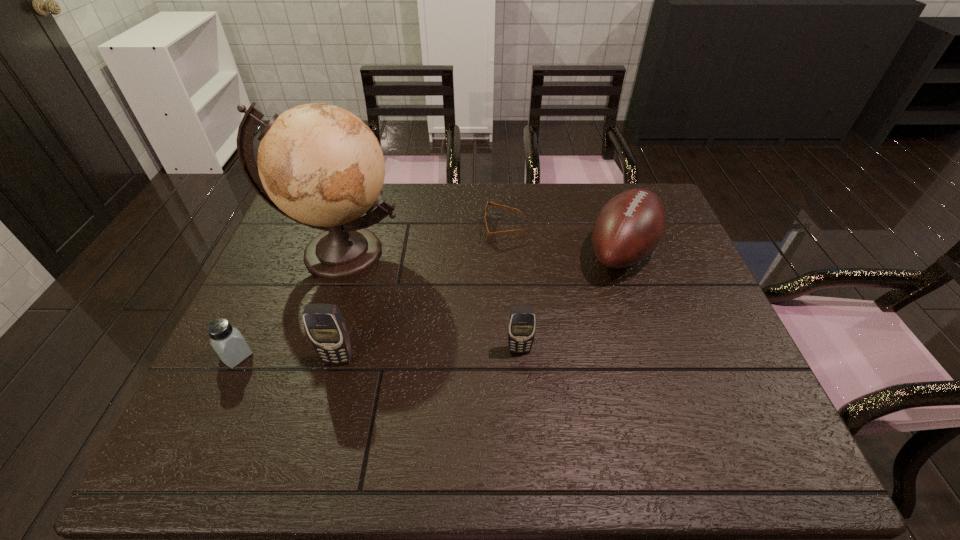
You are a GUI agent. You are given a task and a screenshot of the screen. Output one action in this format:
    pyautogui.click(x=<x>, y=<y>)
    Task: Click on the fifth closest object relative to the shortest object
    The height and width of the screenshot is (540, 960).
    Given the screenshot: What is the action you would take?
    pyautogui.click(x=227, y=341)

You are a GUI agent. You are given a task and a screenshot of the screen. Output one action in this format:
    pyautogui.click(x=<x>, y=<y>)
    Task: Click on the vacant space that satisfies the following two spatial constraints: 1. on the back side of the rightmost object; 2. on the frames of the sunglasses
    This screenshot has height=540, width=960.
    Given the screenshot: What is the action you would take?
    pyautogui.click(x=614, y=229)

Locate an element on the screen. free space that satisfies the following two spatial constraints: 1. on the frames of the sunglasses; 2. on the front face of the taller cellular telephone is located at coordinates (512, 359).

Identify the location of vacant point that satisfies the following two spatial constraints: 1. on the back side of the second shortest object; 2. on the left side of the rightmost object. (285, 252).